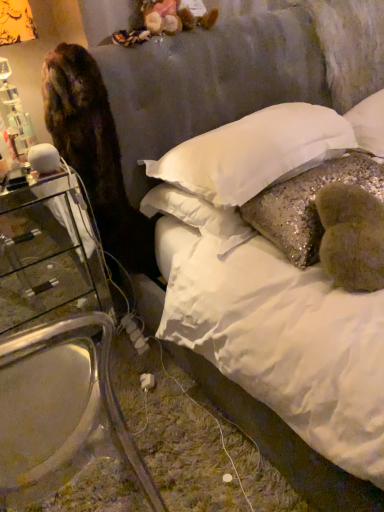
Question: Which direction should I rotate to face glittery sequined pillow at center, positioned as the second pillow in right-to-left order, — up or down?

Choices:
 (A) down
 (B) up

Answer: (B)

Question: Is clear glass nightstand at left with transparent glass armchair at left?

Choices:
 (A) no
 (B) yes

Answer: (A)

Question: Is clear glass nightstand at left smaller than transparent glass armchair at left?

Choices:
 (A) no
 (B) yes

Answer: (B)

Question: Is clear glass nightstand at left oriented towards transparent glass armchair at left?

Choices:
 (A) yes
 (B) no

Answer: (A)

Question: Could transparent glass armchair at left be considered to be inside clear glass nightstand at left?

Choices:
 (A) yes
 (B) no

Answer: (B)

Question: Does clear glass nightstand at left appear on the left side of transparent glass armchair at left?

Choices:
 (A) no
 (B) yes

Answer: (B)

Question: Considering the relative sizes of clear glass nightstand at left and transparent glass armchair at left in the image provided, is clear glass nightstand at left wider than transparent glass armchair at left?

Choices:
 (A) no
 (B) yes

Answer: (A)

Question: From a real-world perspective, is transparent glass armchair at left physically below brown fur cat at left?

Choices:
 (A) yes
 (B) no

Answer: (A)

Question: Does transparent glass armchair at left have a greater height compared to brown fur cat at left?

Choices:
 (A) no
 (B) yes

Answer: (B)

Question: Are transparent glass armchair at left and brown fur cat at left located far from each other?

Choices:
 (A) yes
 (B) no

Answer: (B)

Question: Considering the relative sizes of transparent glass armchair at left and brown fur cat at left in the image provided, is transparent glass armchair at left wider than brown fur cat at left?

Choices:
 (A) no
 (B) yes

Answer: (B)

Question: Are transparent glass armchair at left and brown fur cat at left beside each other?

Choices:
 (A) no
 (B) yes

Answer: (A)

Question: Does transparent glass armchair at left appear on the right side of brown fur cat at left?

Choices:
 (A) yes
 (B) no

Answer: (B)

Question: From the image's perspective, is glittery sequined pillow at center, the 2th pillow positioned from the left, located beneath white sequined pillow at center, the 1th pillow in the left-to-right sequence?

Choices:
 (A) yes
 (B) no

Answer: (A)